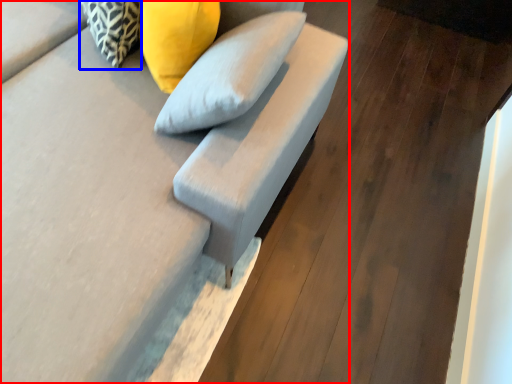
Question: Among these objects, which one is nearest to the camera, furniture (highlighted by a red box) or pillow (highlighted by a blue box)?

Choices:
 (A) furniture
 (B) pillow

Answer: (A)